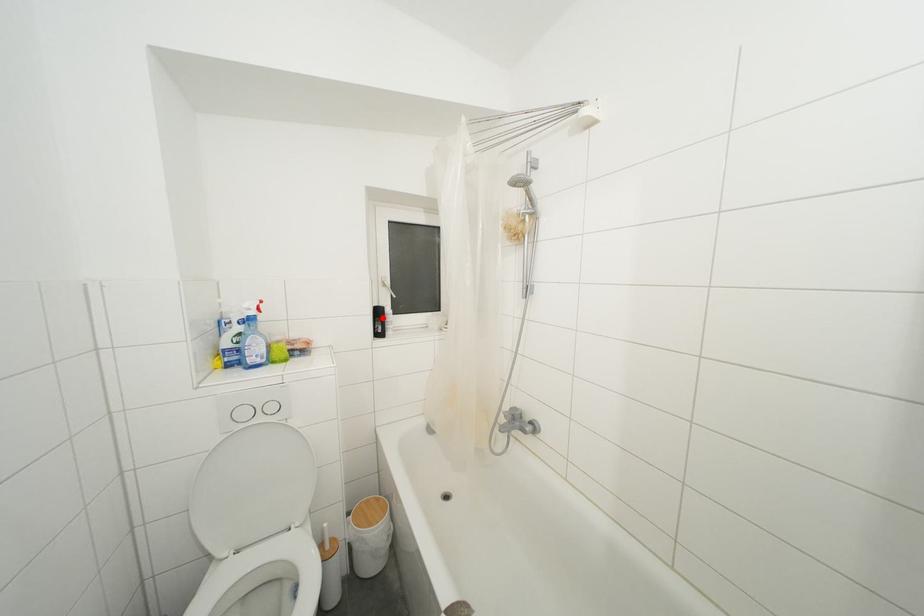
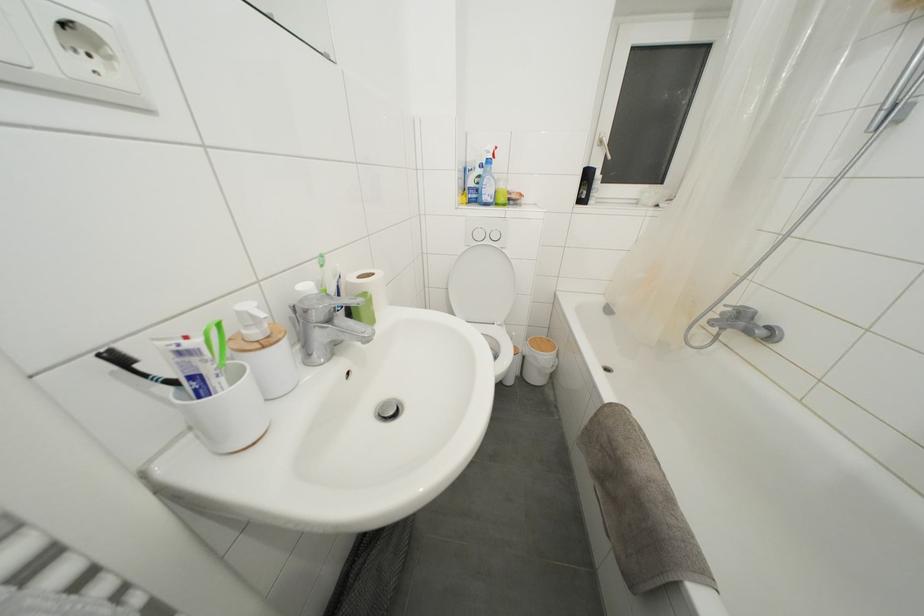
Question: A red point is marked in image1. In image2, is the corresponding 3D point closer to the camera or farther? Reply with the corresponding letter.

Choices:
 (A) The corresponding 3D point is closer.
 (B) The corresponding 3D point is farther.

Answer: (A)